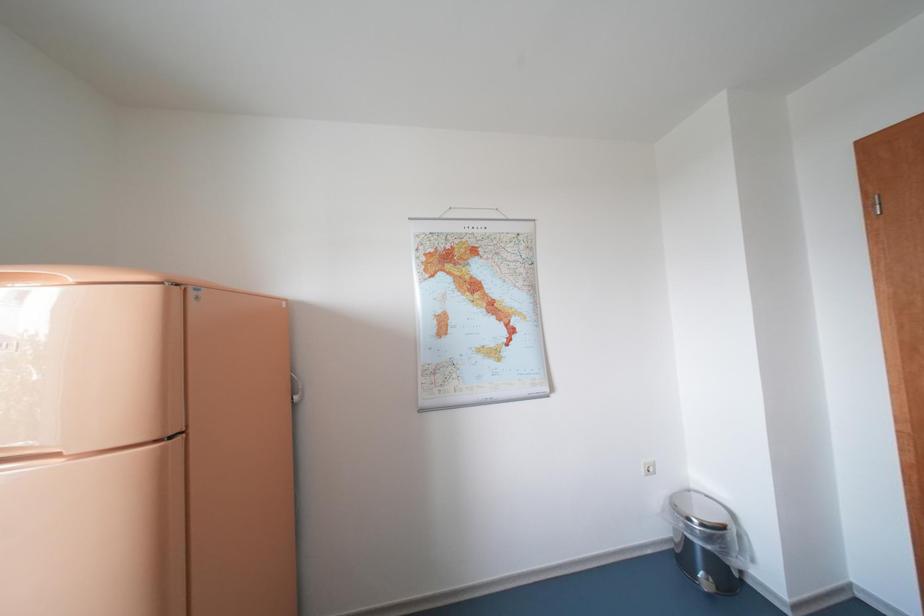
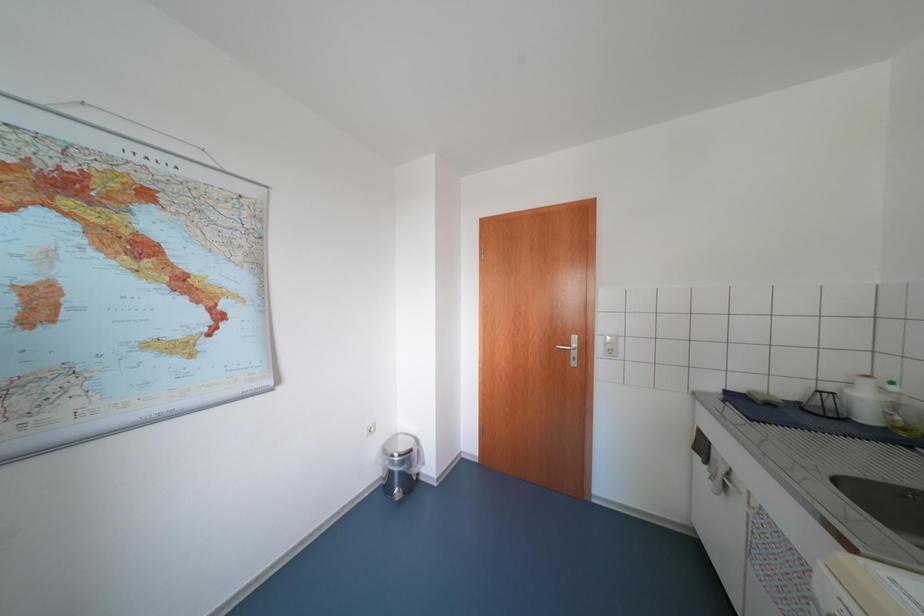
Question: How did the camera likely rotate?

Choices:
 (A) Left
 (B) Right
 (C) Up
 (D) Down

Answer: (B)